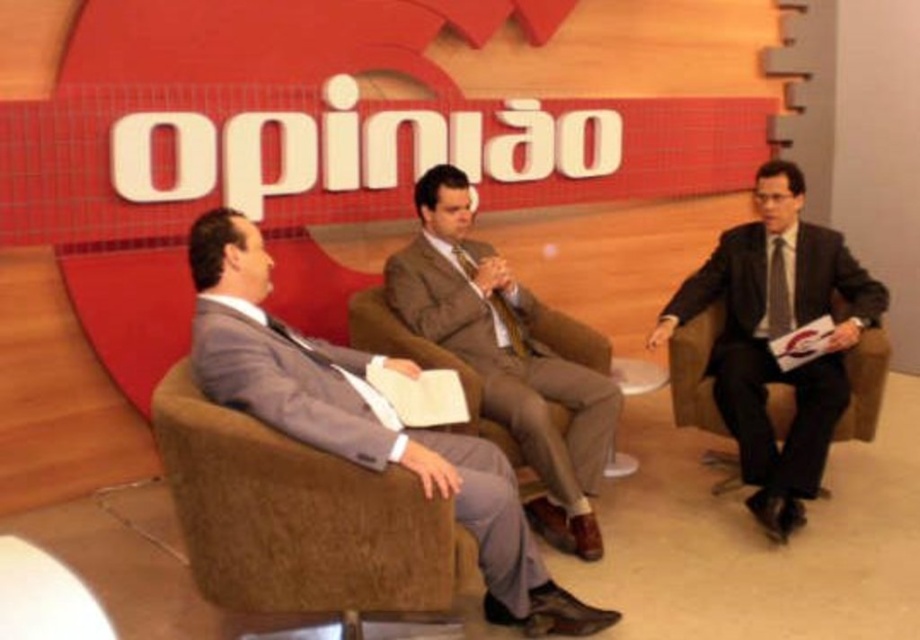
You are standing at the point marked as point (x=328, y=506) in the studio. You need to walk straight to the backdrop with the red circular design. How far will you have to walk?

You will have to walk 7.25 feet to reach the backdrop with the red circular design from point (x=328, y=506).

You are a guest speaker who needs to sit between the two existing chairs in the studio. The chair between the matte gray suit at center and the matte black suit at right is available. Considering the height of the chairs, which chair should you choose if you prefer a seat that is taller?

The chair between the matte gray suit at center and the matte black suit at right that you should choose is the one next to the matte black suit at right because the matte gray suit at center is shorter than the matte black suit at right, implying the chair there is taller.